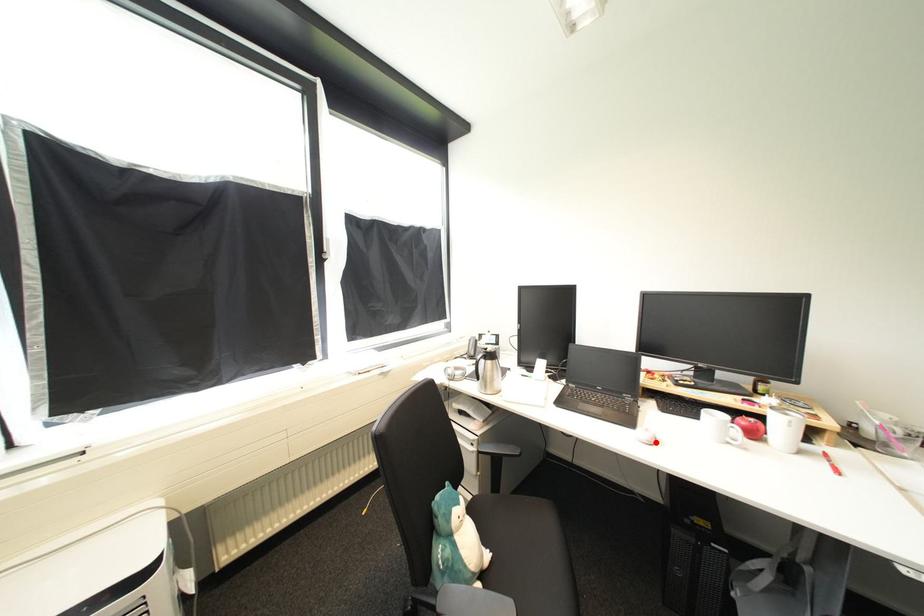
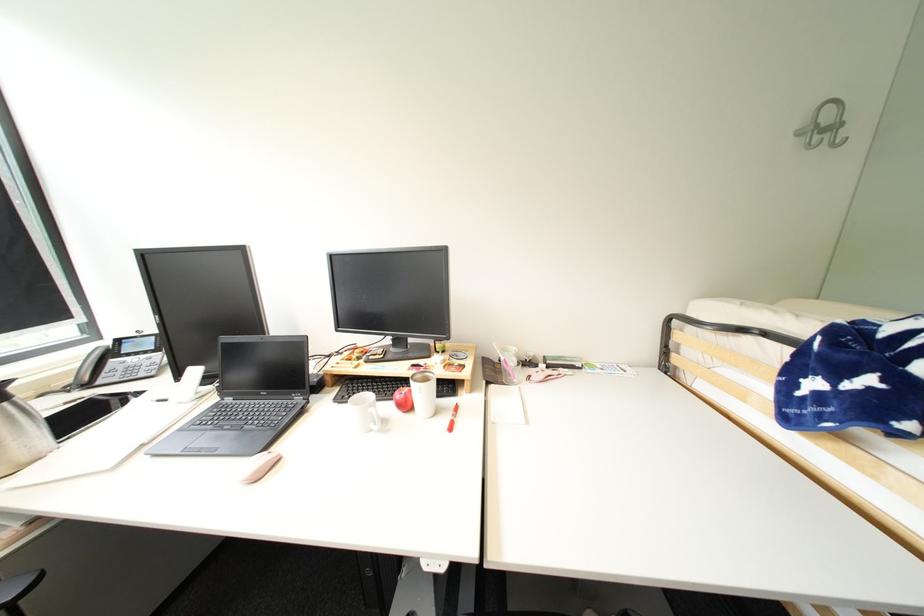
In the second image, find the point that corresponds to the highlighted location in the first image.

(254, 480)